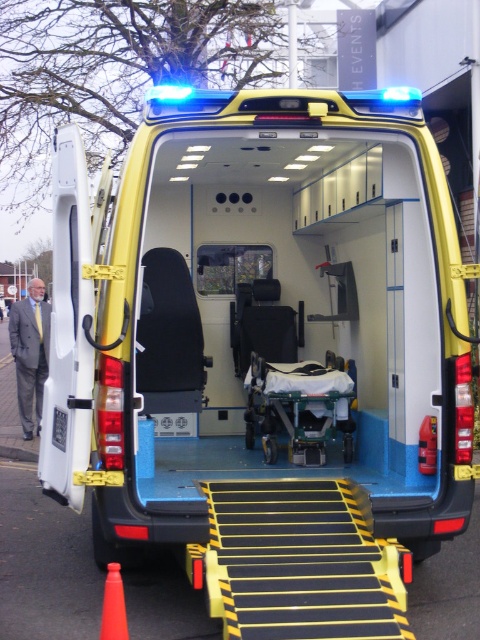
Question: Can you confirm if metallic green stretcher at center is thinner than orange plastic cone at lower left?

Choices:
 (A) no
 (B) yes

Answer: (A)

Question: Which point is closer to the camera?

Choices:
 (A) metallic green stretcher at center
 (B) yellow matte ambulance at center
 (C) orange plastic cone at lower left

Answer: (C)

Question: Is yellow matte ambulance at center in front of metallic green stretcher at center?

Choices:
 (A) yes
 (B) no

Answer: (A)

Question: Which object appears closest to the camera in this image?

Choices:
 (A) orange plastic cone at lower left
 (B) metallic green stretcher at center

Answer: (A)

Question: Is metallic green stretcher at center in front of orange plastic cone at lower left?

Choices:
 (A) no
 (B) yes

Answer: (A)

Question: Considering the real-world distances, which object is farthest from the metallic green stretcher at center?

Choices:
 (A) yellow matte ambulance at center
 (B) orange plastic cone at lower left

Answer: (B)